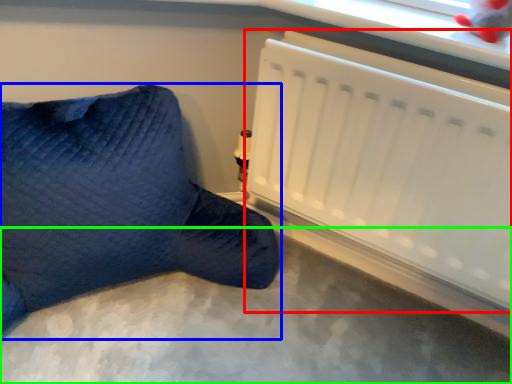
Question: Which object is the closest to the radiator (highlighted by a red box)? Choose among these: furniture (highlighted by a blue box) or concrete (highlighted by a green box).

Choices:
 (A) furniture
 (B) concrete

Answer: (A)